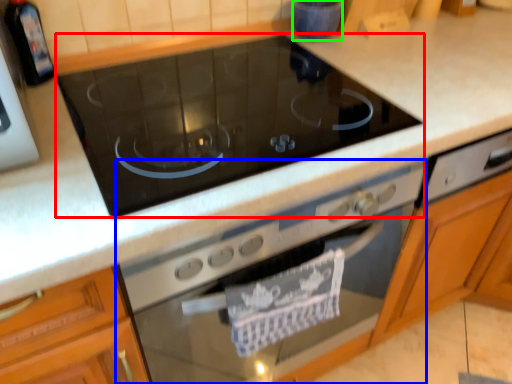
Question: Estimate the real-world distances between objects in this image. Which object is closer to gas stove (highlighted by a red box), home appliance (highlighted by a blue box) or appliance (highlighted by a green box)?

Choices:
 (A) home appliance
 (B) appliance

Answer: (A)